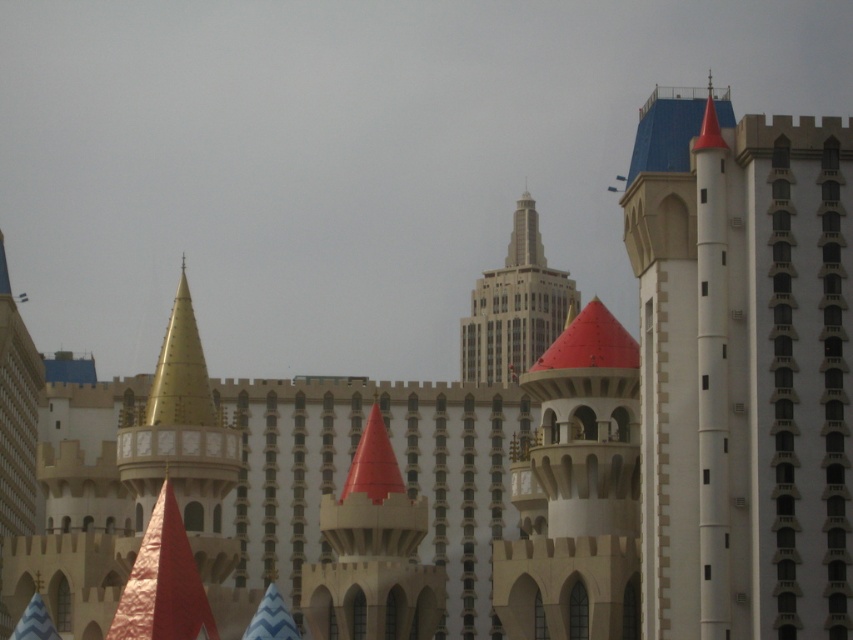
Locate an element on the screen. The height and width of the screenshot is (640, 853). gold metallic spire at center is located at coordinates (180, 371).

The height and width of the screenshot is (640, 853). I want to click on gold metallic spire at center, so click(x=180, y=371).

Can you confirm if smooth white tower at center is shorter than gold metallic spire at center?

In fact, smooth white tower at center may be taller than gold metallic spire at center.

Who is positioned more to the right, smooth white tower at center or gold metallic spire at center?

Positioned to the right is smooth white tower at center.

Locate an element on the screen. smooth white tower at center is located at coordinates (577, 492).

The image size is (853, 640). Find the location of `smooth white tower at center`. smooth white tower at center is located at coordinates (577, 492).

Who is lower down, white stone tower at upper right or smooth beige tower at center?

Positioned lower is white stone tower at upper right.

Can you confirm if white stone tower at upper right is bigger than smooth beige tower at center?

Yes.

Is point (738, 307) behind point (521, 266)?

No, (738, 307) is closer to viewer.

What are the coordinates of `white stone tower at upper right` in the screenshot? It's located at (741, 369).